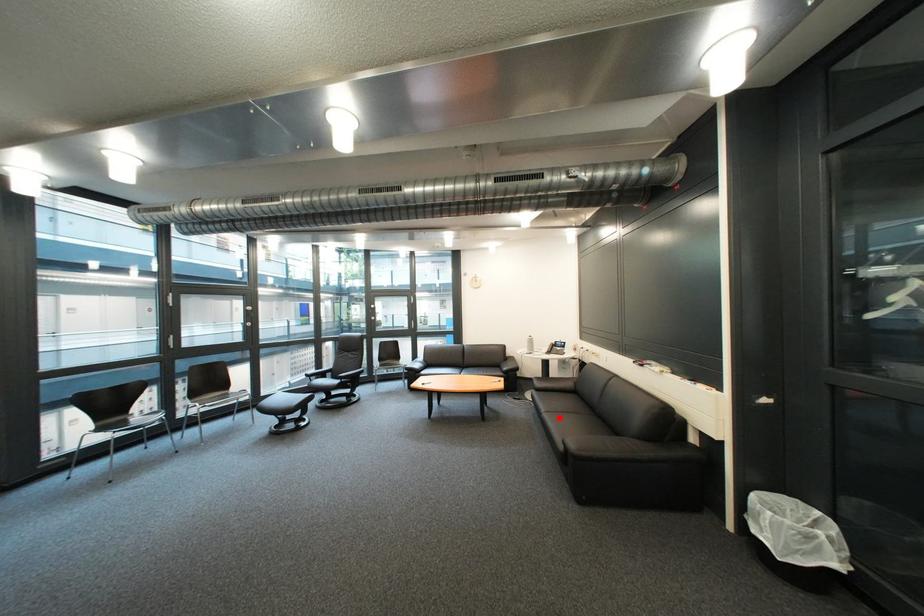
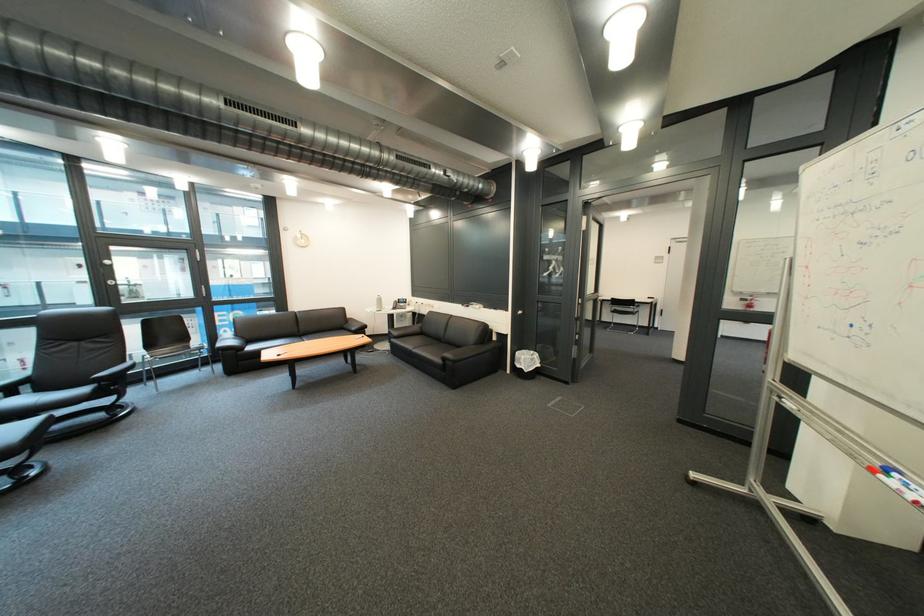
Find the pixel in the second image that matches the highlighted location in the first image.

(429, 353)